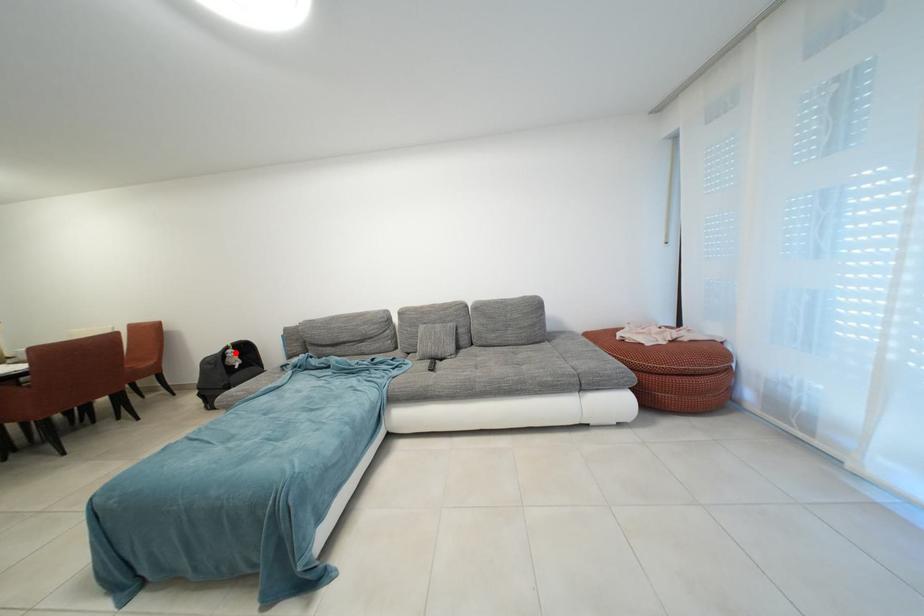
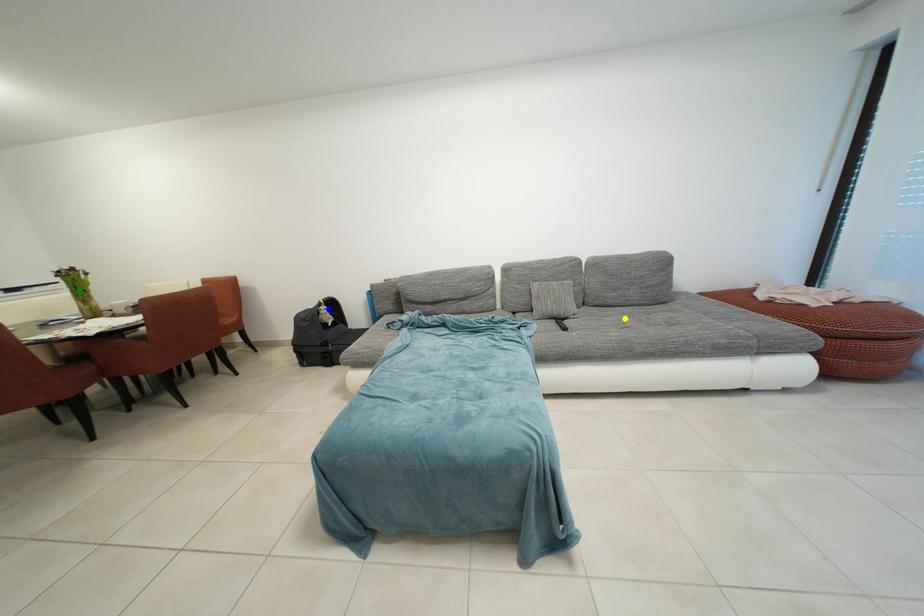
Question: I am providing you with two images of the same scene from different viewpoints. A red point is marked on the first image. You are given multiple points on the second image. Can you choose the point in image 2 that corresponds to the point in image 1?

Choices:
 (A) yellow point
 (B) blue point
 (C) green point

Answer: (B)